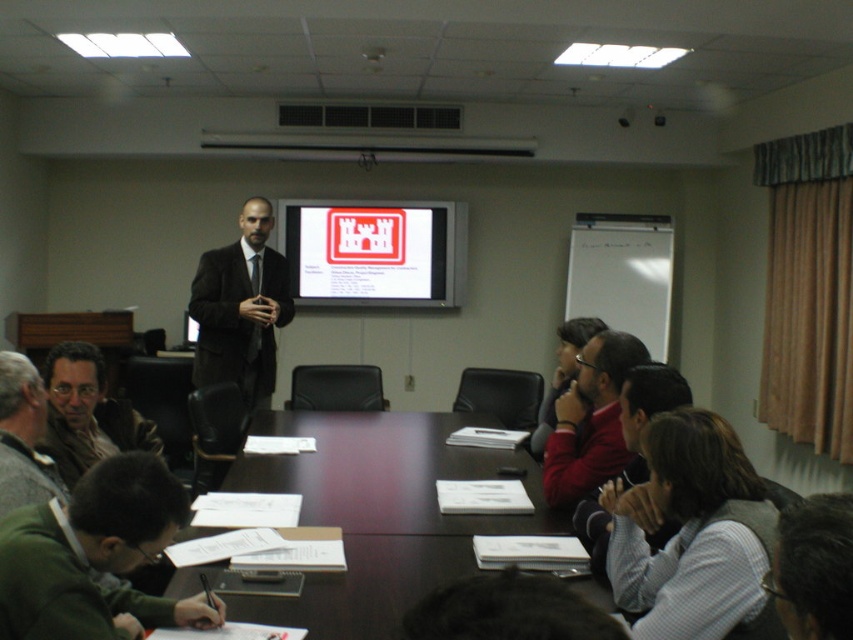
Question: Can you confirm if dark wood table at center is positioned to the left of matte plastic projector screen at center?

Choices:
 (A) no
 (B) yes

Answer: (A)

Question: Which point appears farthest from the camera in this image?

Choices:
 (A) (425, 250)
 (B) (163, 604)
 (C) (212, 253)
 (D) (416, 556)

Answer: (A)

Question: Estimate the real-world distances between objects in this image. Which object is farther from the red sweater at center?

Choices:
 (A) dark wood table at center
 (B) matte brown jacket at lower left

Answer: (B)

Question: Is dark wood table at center thinner than green matte sweater at lower left?

Choices:
 (A) yes
 (B) no

Answer: (B)

Question: Based on their relative distances, which object is nearer to the red sweater at center?

Choices:
 (A) green matte sweater at lower left
 (B) matte brown jacket at lower left
 (C) gray wool sweater at lower left

Answer: (A)

Question: Does dark wood table at center have a lesser width compared to matte plastic projector screen at center?

Choices:
 (A) yes
 (B) no

Answer: (A)